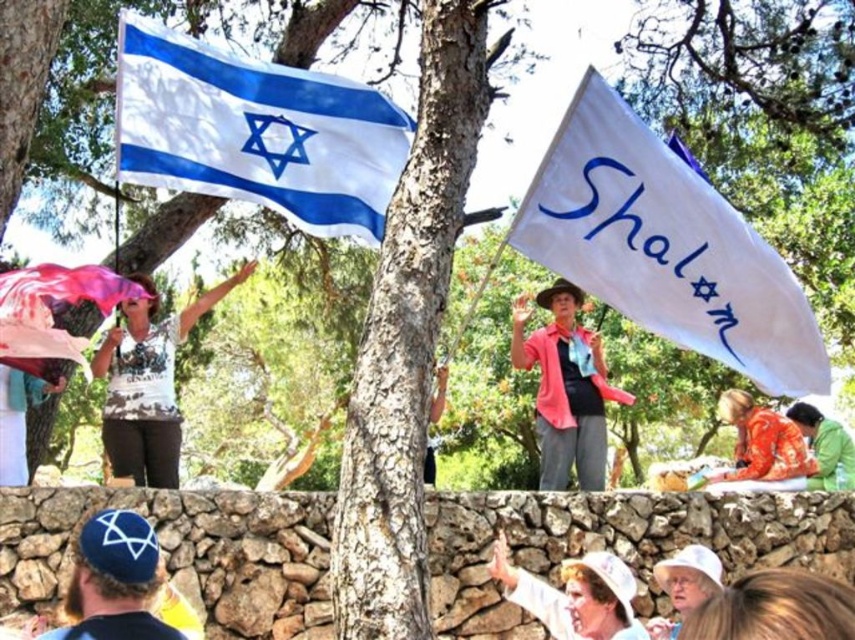
You are a photographer trying to capture the scene. You want to ensure that both the white fabric flag at center and the white matte shirt at upper left are visible in your photo. Based on their positions, which object should appear higher in the frame?

The white fabric flag at center is located above the white matte shirt at upper left, so it should appear higher in the frame.

You are a photographer trying to capture a photo of the white fabric flag at upper left and the green fabric at lower right. Since you want both flags to be clearly visible in the photo, which flag should you focus on first to ensure it appears larger in the image?

The white fabric flag at upper left is bigger than the green fabric at lower right, so you should focus on the white fabric flag at upper left first to ensure it appears larger in the image.